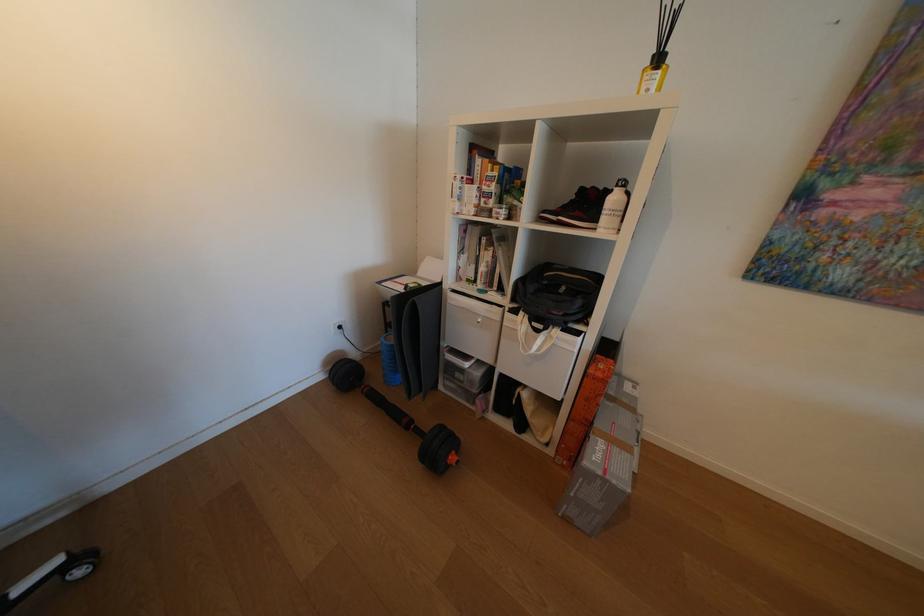
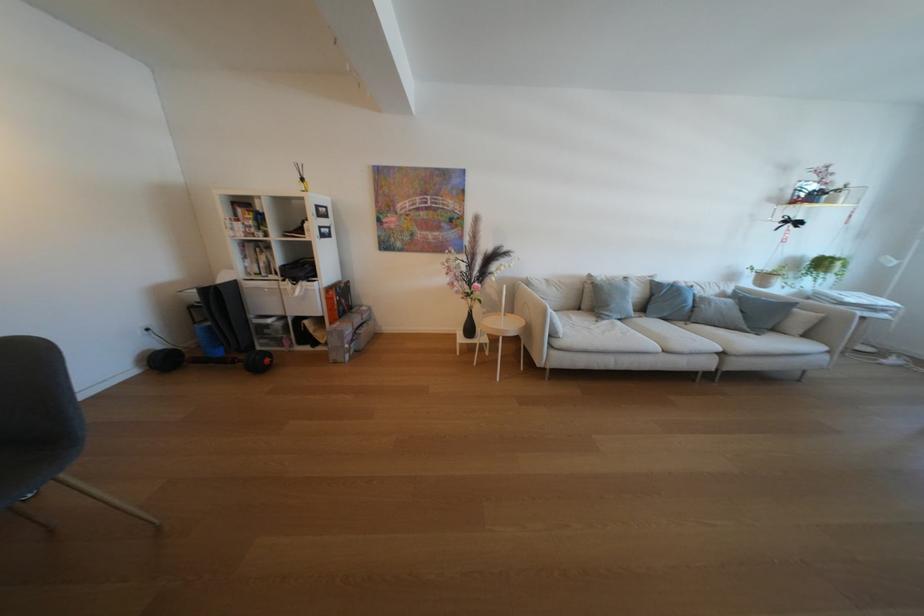
Locate, in the second image, the point that corresponds to (446,387) in the first image.

(265, 351)